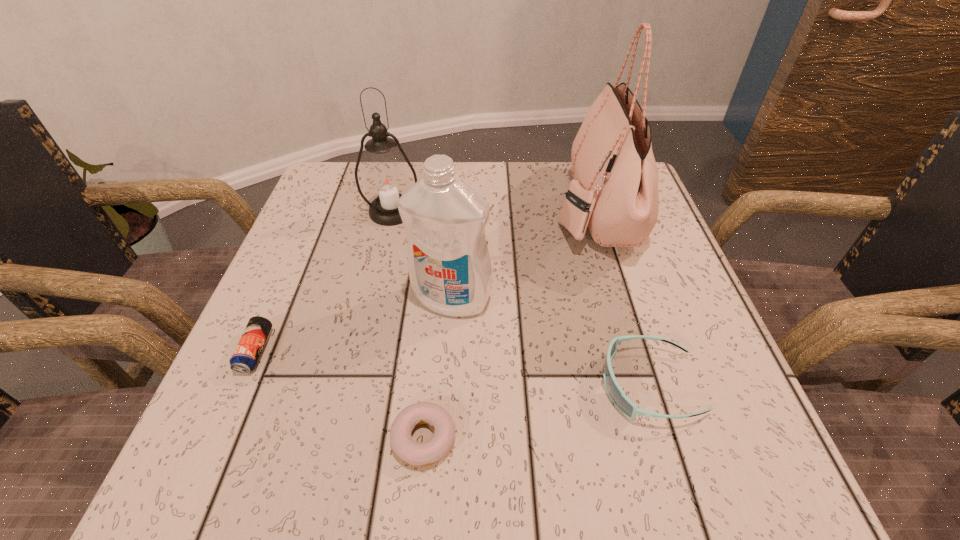
What are the coordinates of `vacant area situated on the back of the fourth nearest object` in the screenshot? It's located at (459, 180).

The width and height of the screenshot is (960, 540). What are the coordinates of `free spot located 0.050m on the right of the second object from left to right` in the screenshot? It's located at (443, 212).

Locate an element on the screen. This screenshot has width=960, height=540. vacant region located 0.200m on the front-facing side of the fourth tallest object is located at coordinates click(473, 385).

I want to click on blank space located on the front-facing side of the fourth tallest object, so click(556, 385).

The width and height of the screenshot is (960, 540). In order to click on vacant region located on the front-facing side of the fourth tallest object in this screenshot , I will do point(402,385).

The image size is (960, 540). Identify the location of free space located on the right of the beer can. (398, 351).

Identify the location of vacant region located on the left of the shortest object. (315, 438).

The width and height of the screenshot is (960, 540). I want to click on handbag positioned at the far edge, so click(x=614, y=191).

This screenshot has height=540, width=960. What are the coordinates of `oil lamp that is positioned at the far edge` in the screenshot? It's located at coord(386,180).

This screenshot has width=960, height=540. What are the coordinates of `goggles that is at the near edge` in the screenshot? It's located at (623, 403).